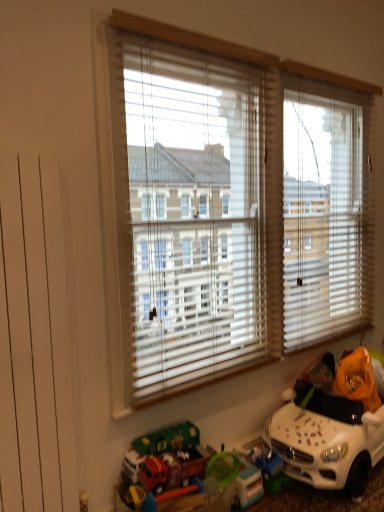
Question: Does red plastic fire truck at lower center, the first toy positioned from the left, have a larger size compared to white plastic toy car at lower right, the 1th toy in the right-to-left sequence?

Choices:
 (A) yes
 (B) no

Answer: (B)

Question: Is white plastic toy car at lower right, the 1th toy in the right-to-left sequence, at the back of red plastic fire truck at lower center, the 2th toy when ordered from right to left?

Choices:
 (A) no
 (B) yes

Answer: (A)

Question: From a real-world perspective, is red plastic fire truck at lower center, the first toy positioned from the left, over white plastic toy car at lower right, the 1th toy in the right-to-left sequence?

Choices:
 (A) no
 (B) yes

Answer: (A)

Question: Is red plastic fire truck at lower center, the first toy positioned from the left, aimed at white plastic toy car at lower right, the 1th toy in the right-to-left sequence?

Choices:
 (A) no
 (B) yes

Answer: (A)

Question: Is white plastic toy car at lower right, acting as the 2th toy starting from the left, located within red plastic fire truck at lower center, the 2th toy when ordered from right to left?

Choices:
 (A) no
 (B) yes

Answer: (A)

Question: Considering their positions, is red plastic fire truck at lower center, the first toy positioned from the left, located in front of or behind white plastic toy car at lower right, the 1th toy in the right-to-left sequence?

Choices:
 (A) behind
 (B) front

Answer: (B)

Question: Is point (185, 462) positioned closer to the camera than point (360, 473)?

Choices:
 (A) closer
 (B) farther

Answer: (A)

Question: Based on their positions, is red plastic fire truck at lower center, the first toy positioned from the left, located to the left or right of white plastic toy car at lower right, the 1th toy in the right-to-left sequence?

Choices:
 (A) right
 (B) left

Answer: (B)

Question: From their relative heights in the image, would you say red plastic fire truck at lower center, the 2th toy when ordered from right to left, is taller or shorter than white plastic toy car at lower right, the 1th toy in the right-to-left sequence?

Choices:
 (A) tall
 (B) short

Answer: (B)

Question: From the image's perspective, is white blinds at center located above or below red plastic fire truck at lower center, the 2th toy when ordered from right to left?

Choices:
 (A) below
 (B) above

Answer: (B)

Question: Considering the positions of point (243, 264) and point (147, 485), is point (243, 264) closer or farther from the camera than point (147, 485)?

Choices:
 (A) farther
 (B) closer

Answer: (A)

Question: Is white blinds at center spatially inside red plastic fire truck at lower center, the first toy positioned from the left, or outside of it?

Choices:
 (A) outside
 (B) inside

Answer: (A)

Question: In terms of width, does white blinds at center look wider or thinner when compared to red plastic fire truck at lower center, the first toy positioned from the left?

Choices:
 (A) wide
 (B) thin

Answer: (B)

Question: In the image, is white plastic toy car at lower right, the 1th toy in the right-to-left sequence, on the left side or the right side of white blinds at center?

Choices:
 (A) left
 (B) right

Answer: (B)

Question: From a real-world perspective, relative to white blinds at center, is white plastic toy car at lower right, the 1th toy in the right-to-left sequence, vertically above or below?

Choices:
 (A) below
 (B) above

Answer: (A)